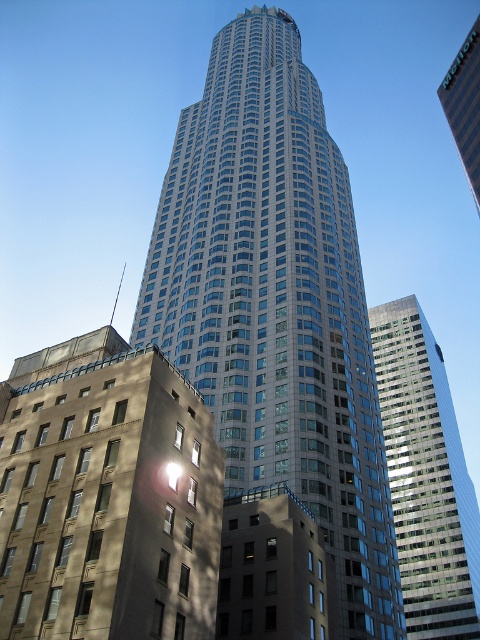
You are standing in front of the skyscraper and notice two points marked on the facade. The first point is at coordinates point (228, 150) and the second is at point (478, 147). Which point is closer to you?

Point (228, 150) is closer to the viewer than point (478, 147).

You are standing on the sidewalk in front of the two skyscrapers. Which one is closer to you, the glassy silver skyscraper at center or the glassy reflective skyscraper at right?

The glassy silver skyscraper at center is closer to you because it is positioned over the glassy reflective skyscraper at right, indicating it is in front.

You are standing in the middle of the street facing the glassy silver skyscraper at center and the beige concrete building at lower left. Which building is closer to your right side?

The glassy silver skyscraper at center is to the right of the beige concrete building at lower left, so when facing them, the glassy silver skyscraper at center is closer to your right side.